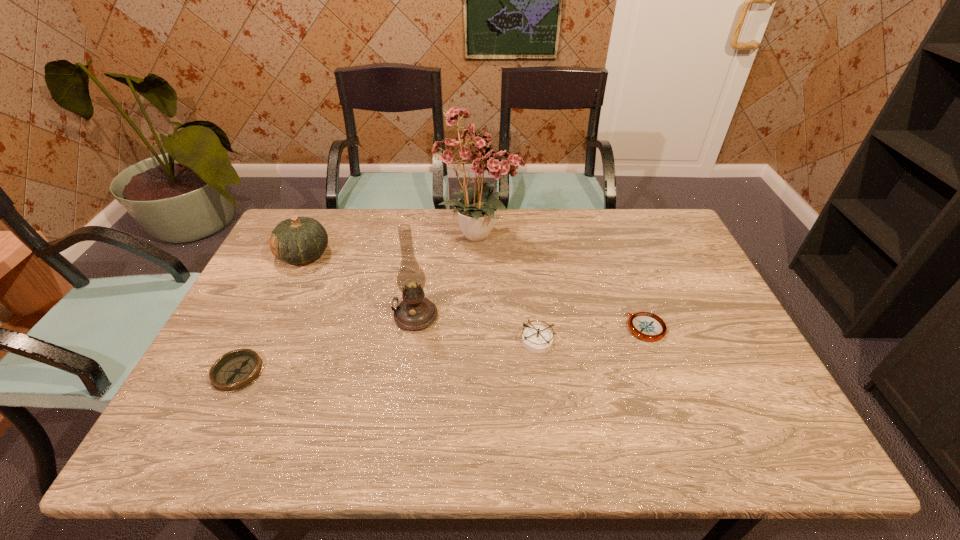
Where is `unoccupied area between the gourd and the tallest object`? This screenshot has height=540, width=960. unoccupied area between the gourd and the tallest object is located at coordinates (392, 245).

Identify the location of free space between the rightmost compass and the leftmost compass. (442, 350).

Locate which object is the fourth closest to the flower arrangement. Please provide its 2D coordinates. Your answer should be formatted as a tuple, i.e. [(x, y)], where the tuple contains the x and y coordinates of a point satisfying the conditions above.

[(647, 326)]

Where is `the third closest object to the rightmost compass`? The height and width of the screenshot is (540, 960). the third closest object to the rightmost compass is located at coordinates (415, 312).

Locate an element on the screen. This screenshot has width=960, height=540. the second closest compass to the oil lamp is located at coordinates (235, 370).

This screenshot has width=960, height=540. I want to click on compass that can be found as the closest to the gourd, so click(x=235, y=370).

I want to click on free spot that satisfies the following two spatial constraints: 1. on the front-facing side of the flower arrangement; 2. on the right side of the second compass from left to right, so click(479, 341).

Locate an element on the screen. The width and height of the screenshot is (960, 540). vacant space that satisfies the following two spatial constraints: 1. on the front-facing side of the tallest object; 2. on the left side of the rightmost compass is located at coordinates click(x=479, y=328).

Locate an element on the screen. Image resolution: width=960 pixels, height=540 pixels. vacant point that satisfies the following two spatial constraints: 1. on the front-facing side of the rightmost object; 2. on the left side of the tallest object is located at coordinates (479, 328).